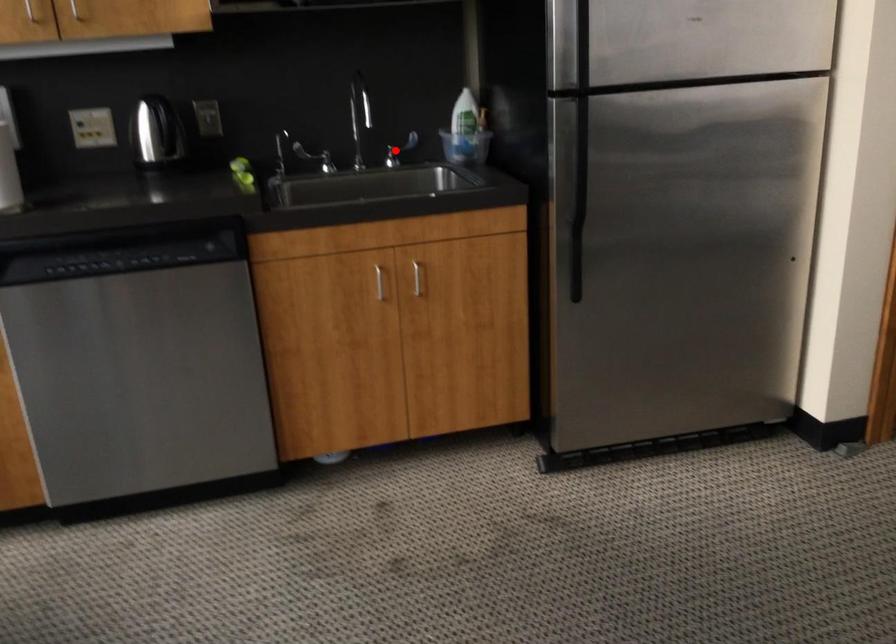
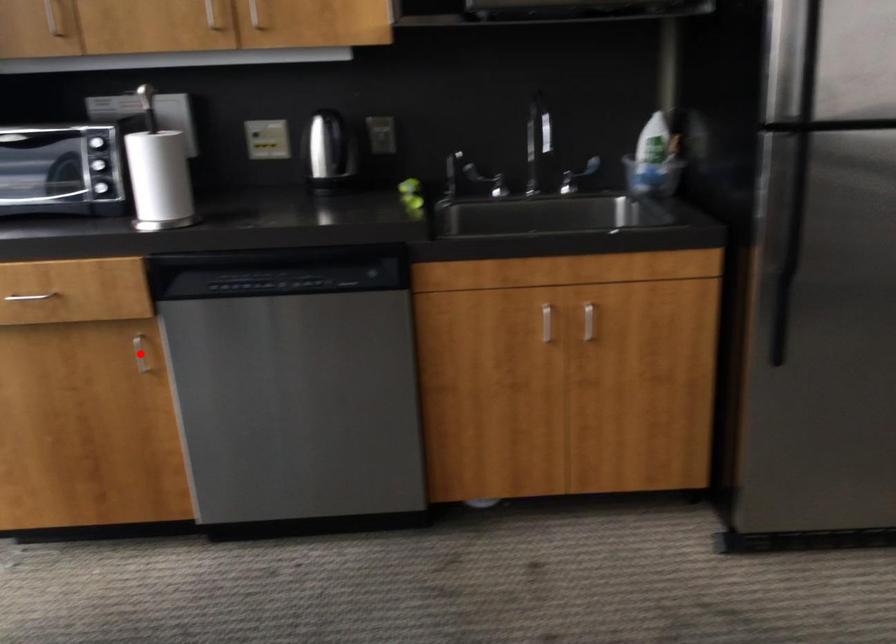
I am providing you with two images of the same scene from different viewpoints. A red point is marked on the first image and another point is marked on the second image. Do the highlighted points in image1 and image2 indicate the same real-world spot?

No